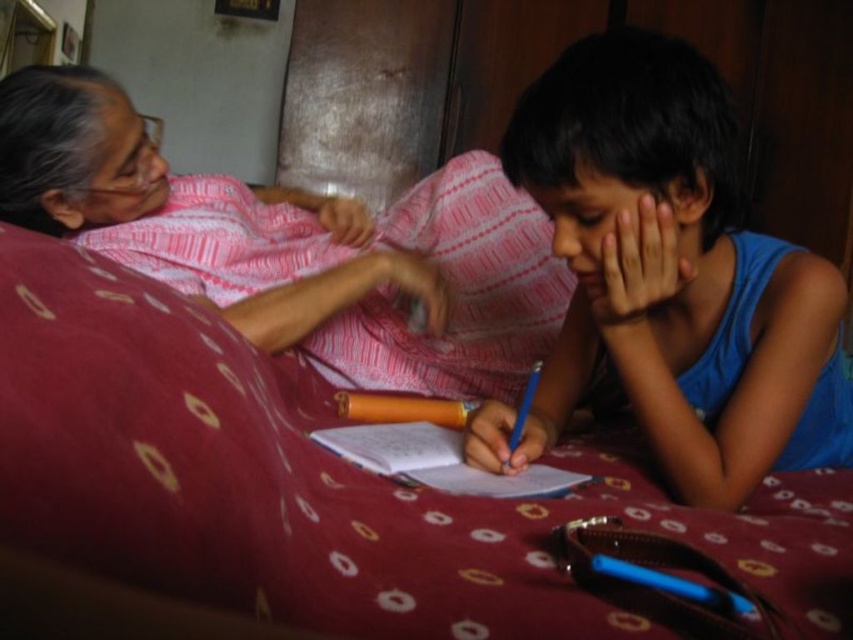
Question: Is maroon fabric bed at center wider than blue matte shirt at center?

Choices:
 (A) no
 (B) yes

Answer: (B)

Question: Among these points, which one is farthest from the camera?

Choices:
 (A) (143, 244)
 (B) (131, 387)
 (C) (767, 412)

Answer: (A)

Question: Can you confirm if blue matte shirt at center is positioned to the left of matte pink fabric at upper left?

Choices:
 (A) yes
 (B) no

Answer: (B)

Question: Considering the real-world distances, which object is closest to the blue matte shirt at center?

Choices:
 (A) matte pink fabric at upper left
 (B) maroon fabric bed at center

Answer: (B)

Question: Which object is farther from the camera taking this photo?

Choices:
 (A) blue matte shirt at center
 (B) matte pink fabric at upper left
 (C) maroon fabric bed at center

Answer: (B)

Question: Is blue matte shirt at center below matte pink fabric at upper left?

Choices:
 (A) no
 (B) yes

Answer: (B)